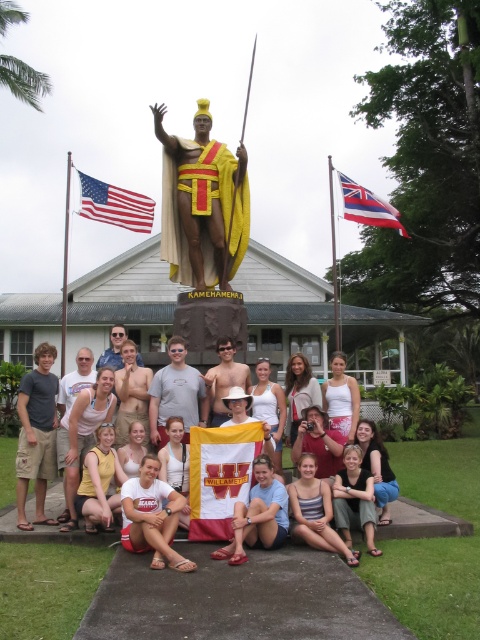
You are a photographer trying to capture a group photo. You notice the tan skin shirtless man at center and the hawaiian flag at upper right. Which object takes up more space in the photo?

The Hawaiian flag at upper right takes up more space in the photo because the tan skin shirtless man at center has a lesser width compared to the Hawaiian flag at upper right.

You are a photographer standing at the center of the scene. You want to take a photo that includes both the shiny gold necklace at center and the hawaiian flag at upper right. Given that your camera has a maximum zoom range of 30 meters, will you be able to capture both objects in the same frame without moving?

The distance between the shiny gold necklace at center and the hawaiian flag at upper right is 28.49 meters, which is within the camera maximum zoom range of 30 meters. Therefore, you can capture both objects in the same frame without moving.